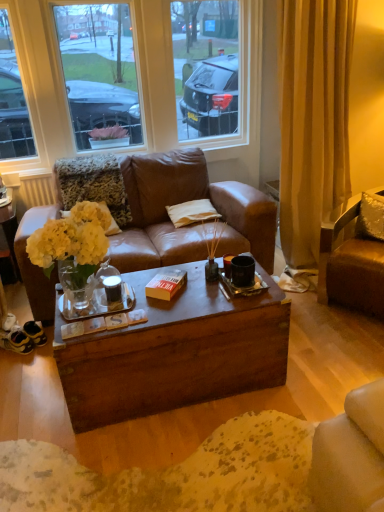
Question: Does yellow matte flowers at center have a lesser height compared to clear glass window at upper center?

Choices:
 (A) yes
 (B) no

Answer: (A)

Question: Is the position of yellow matte flowers at center more distant than that of clear glass window at upper center?

Choices:
 (A) yes
 (B) no

Answer: (B)

Question: Can you confirm if yellow matte flowers at center is thinner than clear glass window at upper center?

Choices:
 (A) yes
 (B) no

Answer: (B)

Question: Does yellow matte flowers at center appear on the left side of clear glass window at upper center?

Choices:
 (A) no
 (B) yes

Answer: (B)

Question: Is yellow matte flowers at center beside clear glass window at upper center?

Choices:
 (A) yes
 (B) no

Answer: (B)

Question: Is yellow matte flowers at center turned away from clear glass window at upper center?

Choices:
 (A) no
 (B) yes

Answer: (A)

Question: Is orange matte book at center oriented towards beige fabric pillow at center, the second pillow positioned from the front?

Choices:
 (A) yes
 (B) no

Answer: (B)

Question: Is orange matte book at center wider than beige fabric pillow at center, positioned as the second pillow in right-to-left order?

Choices:
 (A) yes
 (B) no

Answer: (B)

Question: Is orange matte book at center to the right of beige fabric pillow at center, the second pillow positioned from the front, from the viewer's perspective?

Choices:
 (A) yes
 (B) no

Answer: (B)

Question: Is orange matte book at center positioned in front of beige fabric pillow at center, the 1th pillow viewed from the back?

Choices:
 (A) yes
 (B) no

Answer: (A)

Question: From the image's perspective, would you say orange matte book at center is shown under beige fabric pillow at center, the second pillow positioned from the front?

Choices:
 (A) yes
 (B) no

Answer: (A)

Question: Is orange matte book at center in contact with beige fabric pillow at center, acting as the first pillow starting from the left?

Choices:
 (A) yes
 (B) no

Answer: (B)

Question: Is brown leather chair at right positioned far away from satin silver pillow at upper right, placed as the second pillow when sorted from back to front?

Choices:
 (A) no
 (B) yes

Answer: (A)